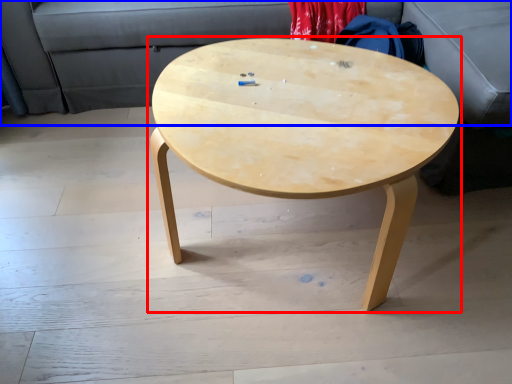
Question: Among these objects, which one is nearest to the camera, coffee table (highlighted by a red box) or couch (highlighted by a blue box)?

Choices:
 (A) coffee table
 (B) couch

Answer: (A)